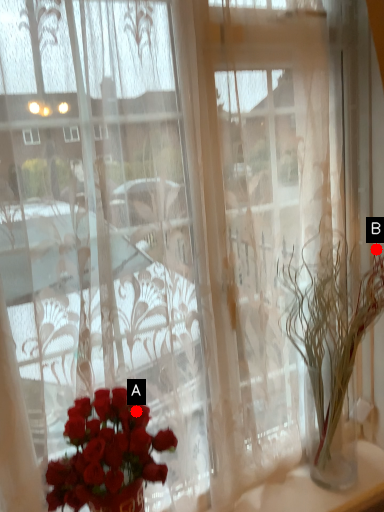
Question: Two points are circled on the image, labeled by A and B beside each circle. Which point is farther from the camera taking this photo?

Choices:
 (A) A is further
 (B) B is further

Answer: (B)